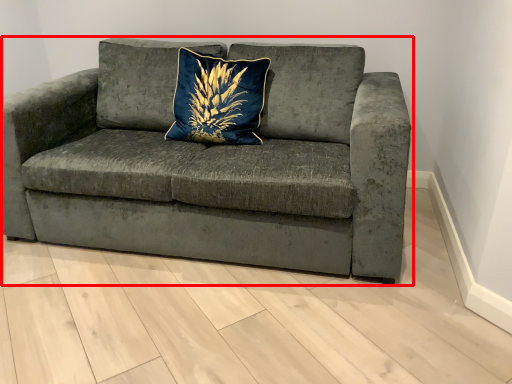
Question: From the image, what is the correct spatial relationship of studio couch (annotated by the red box) in relation to pillow?

Choices:
 (A) right
 (B) left

Answer: (B)